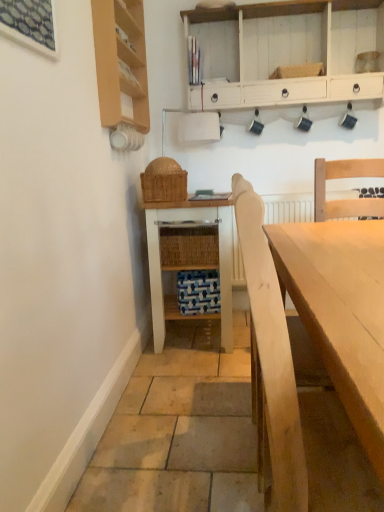
Question: Is white painted wood table at center behind white wood cabinet at upper center?

Choices:
 (A) yes
 (B) no

Answer: (B)

Question: Can you confirm if white painted wood table at center is positioned to the right of white wood cabinet at upper center?

Choices:
 (A) yes
 (B) no

Answer: (B)

Question: From a real-world perspective, is white painted wood table at center located higher than white wood cabinet at upper center?

Choices:
 (A) yes
 (B) no

Answer: (B)

Question: Does white painted wood table at center come in front of white wood cabinet at upper center?

Choices:
 (A) no
 (B) yes

Answer: (B)

Question: Does white painted wood table at center have a lesser width compared to white wood cabinet at upper center?

Choices:
 (A) yes
 (B) no

Answer: (B)

Question: From the image's perspective, is white painted wood table at center under white wood cabinet at upper center?

Choices:
 (A) yes
 (B) no

Answer: (A)

Question: Considering the relative sizes of white painted wood table at center and woven brown picnic basket at center in the image provided, is white painted wood table at center thinner than woven brown picnic basket at center?

Choices:
 (A) no
 (B) yes

Answer: (A)

Question: From a real-world perspective, is white painted wood table at center positioned under woven brown picnic basket at center based on gravity?

Choices:
 (A) no
 (B) yes

Answer: (B)

Question: Is white painted wood table at center further to the viewer compared to woven brown picnic basket at center?

Choices:
 (A) yes
 (B) no

Answer: (A)

Question: Is woven brown picnic basket at center located within white painted wood table at center?

Choices:
 (A) yes
 (B) no

Answer: (B)

Question: Is white painted wood table at center placed right next to woven brown picnic basket at center?

Choices:
 (A) no
 (B) yes

Answer: (A)

Question: From the image's perspective, is white painted wood table at center over woven brown picnic basket at center?

Choices:
 (A) yes
 (B) no

Answer: (B)

Question: Considering the relative positions of wooden shelf at upper left and white wood cabinet at upper center in the image provided, is wooden shelf at upper left to the left of white wood cabinet at upper center from the viewer's perspective?

Choices:
 (A) yes
 (B) no

Answer: (A)